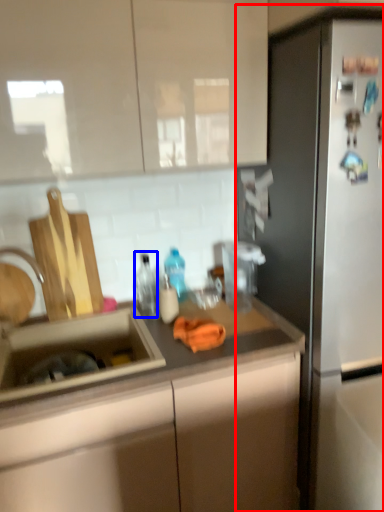
Question: Among these objects, which one is farthest to the camera, refrigerator (highlighted by a red box) or bottle (highlighted by a blue box)?

Choices:
 (A) refrigerator
 (B) bottle

Answer: (B)